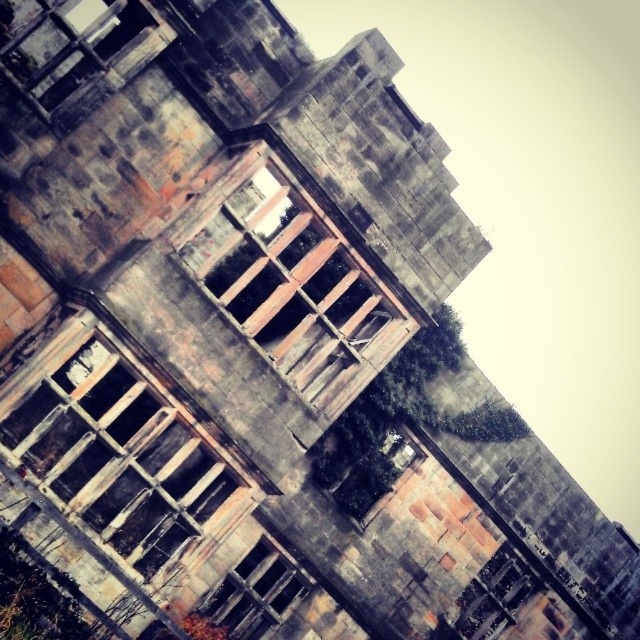
Question: Which point appears farthest from the camera in this image?

Choices:
 (A) (90, 364)
 (B) (284, 230)

Answer: (B)

Question: Can you confirm if wooden planks at center is wider than rusty metal window at center?

Choices:
 (A) yes
 (B) no

Answer: (B)

Question: Which of the following is the farthest from the observer?

Choices:
 (A) wooden planks at center
 (B) rusty metal window at center
 (C) wooden frame window at lower left

Answer: (B)

Question: Is wooden frame window at lower left wider than wooden planks at center?

Choices:
 (A) no
 (B) yes

Answer: (B)

Question: Which point appears closest to the camera in this image?

Choices:
 (A) click(x=156, y=449)
 (B) click(x=269, y=240)
 (C) click(x=289, y=589)

Answer: (A)

Question: Is wooden planks at center below rusty metal window at center?

Choices:
 (A) yes
 (B) no

Answer: (B)